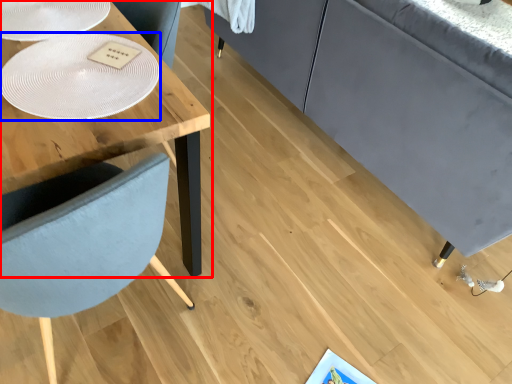
Question: Which object appears closest to the camera in this image, table (highlighted by a red box) or glass plate (highlighted by a blue box)?

Choices:
 (A) table
 (B) glass plate

Answer: (B)